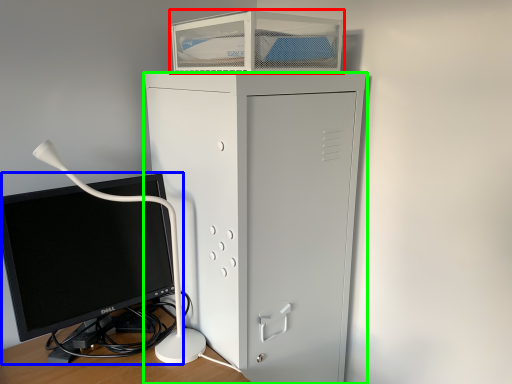
Question: Considering the real-world distances, which object is farthest from desktop (highlighted by a red box)? computer monitor (highlighted by a blue box) or furniture (highlighted by a green box)?

Choices:
 (A) computer monitor
 (B) furniture

Answer: (A)